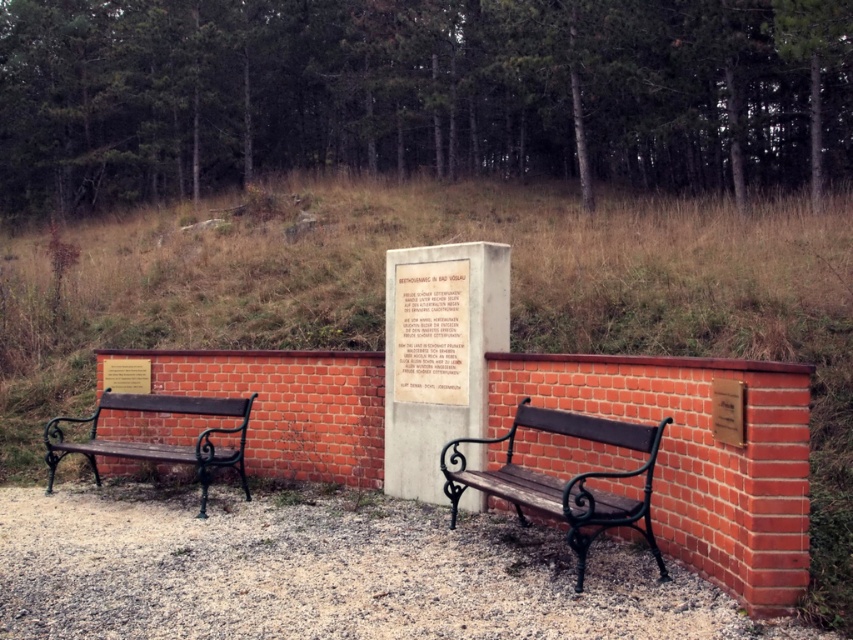
Who is more forward, [456,492] or [114,452]?

Point [456,492] is more forward.

What are the coordinates of `wooden bench at center` in the screenshot? It's located at (563, 480).